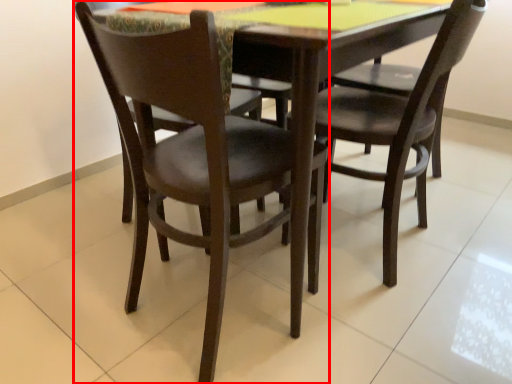
Question: From the image's perspective, considering the relative positions of chair (annotated by the red box) and chair in the image provided, where is chair (annotated by the red box) located with respect to the staircase?

Choices:
 (A) below
 (B) above

Answer: (A)